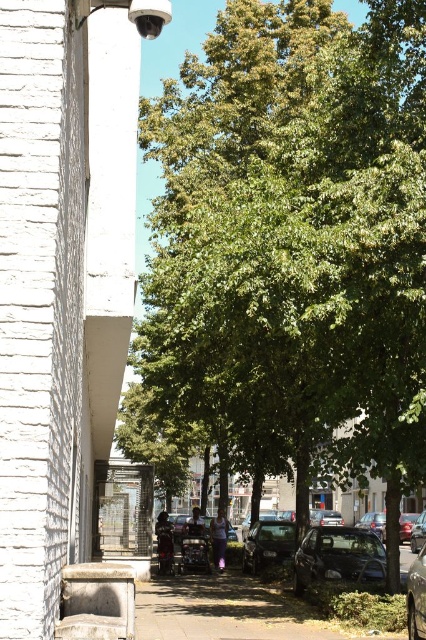
Who is lower down, green leafy tree at center or brown concrete sidewalk at center?

brown concrete sidewalk at center is lower down.

Can you confirm if green leafy tree at center is positioned to the left of brown concrete sidewalk at center?

No, green leafy tree at center is not to the left of brown concrete sidewalk at center.

You are a GUI agent. You are given a task and a screenshot of the screen. Output one action in this format:
    pyautogui.click(x=<x>, y=<y>)
    Task: Click on the green leafy tree at center
    The image size is (426, 640).
    Given the screenshot: What is the action you would take?
    pyautogui.click(x=291, y=241)

You are a GUI agent. You are given a task and a screenshot of the screen. Output one action in this format:
    pyautogui.click(x=<x>, y=<y>)
    Task: Click on the green leafy tree at center
    
    Given the screenshot: What is the action you would take?
    pyautogui.click(x=291, y=241)

Between point (215, 269) and point (362, 561), which one is positioned in front?

Point (215, 269) is more forward.

This screenshot has height=640, width=426. Find the location of `green leafy tree at center`. green leafy tree at center is located at coordinates (291, 241).

Which of these two, green leafy tree at center or shiny black sedan at center, stands taller?

Standing taller between the two is green leafy tree at center.

Is green leafy tree at center wider than shiny black sedan at center?

No.

Where is `green leafy tree at center`? Image resolution: width=426 pixels, height=640 pixels. green leafy tree at center is located at coordinates (291, 241).